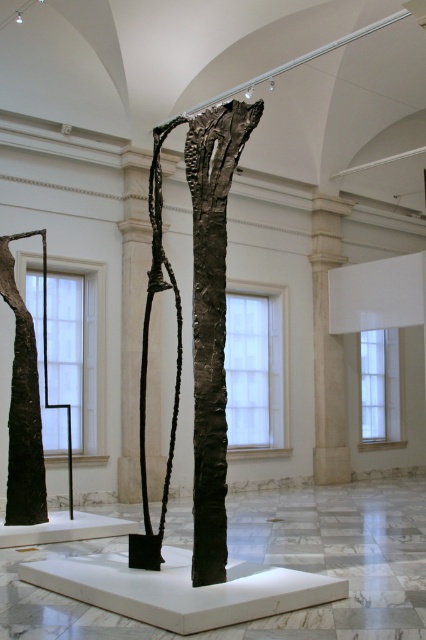
Who is taller, light beige stone column at center or black textured tree trunk at left?

Standing taller between the two is black textured tree trunk at left.

This screenshot has width=426, height=640. What are the coordinates of `light beige stone column at center` in the screenshot? It's located at (328, 344).

Identify the location of light beige stone column at center. (328, 344).

Can you confirm if dark bronze sculpture at center is smaller than black textured tree trunk at left?

No.

Is dark bronze sculpture at center shorter than black textured tree trunk at left?

Incorrect, dark bronze sculpture at center's height does not fall short of black textured tree trunk at left's.

Find the location of a particular element. This screenshot has width=426, height=640. dark bronze sculpture at center is located at coordinates (196, 330).

Find the location of a particular element. The height and width of the screenshot is (640, 426). dark bronze sculpture at center is located at coordinates (196, 330).

Can you confirm if dark bronze sculpture at center is thinner than black textured sculpture at center?

No.

Is dark bronze sculpture at center smaller than black textured sculpture at center?

No, dark bronze sculpture at center is not smaller than black textured sculpture at center.

Between point (150, 291) and point (123, 252), which one is positioned behind?

The point (123, 252) is more distant.

Where is `dark bronze sculpture at center`? dark bronze sculpture at center is located at coordinates click(x=196, y=330).